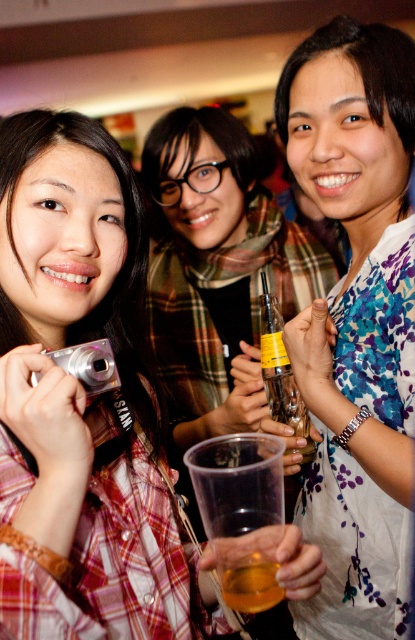
You are at a party and want to pour the contents of the clear plastic bottle at center into the translucent plastic cup at center. Can you fit all the liquid from the bottle into the cup without spilling?

The clear plastic bottle at center might be wider than translucent plastic cup at center, so there is a possibility that the bottle is wider, which could mean the cup might not hold all the liquid if the cup is narrower. However, without knowing the exact volumes, it is uncertain whether it will spill or not.

You are a bartender at this event and need to place a new drink order between the clear plastic bottle at center and the translucent plastic cup at center. The drink order requires exactly 18 inches of space. Can you fit it there?

The clear plastic bottle at center is 17.76 inches away from the translucent plastic cup at center, so there isn not enough space to fit the drink order requiring exactly 18 inches between them.

Based on the provided coordinates, which object corresponds to the point at (x=83, y=403)?

The point at (x=83, y=403) corresponds to the matte black camera at left.